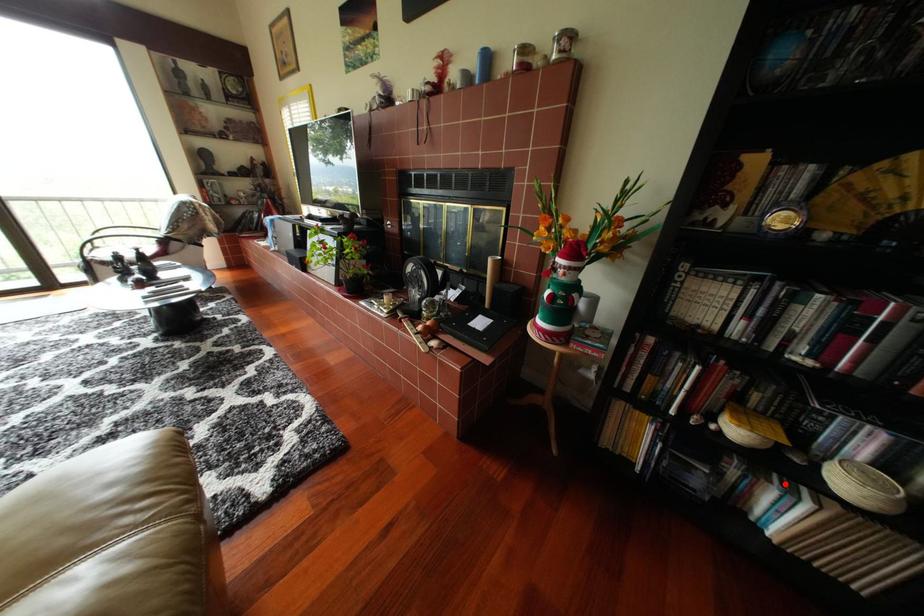
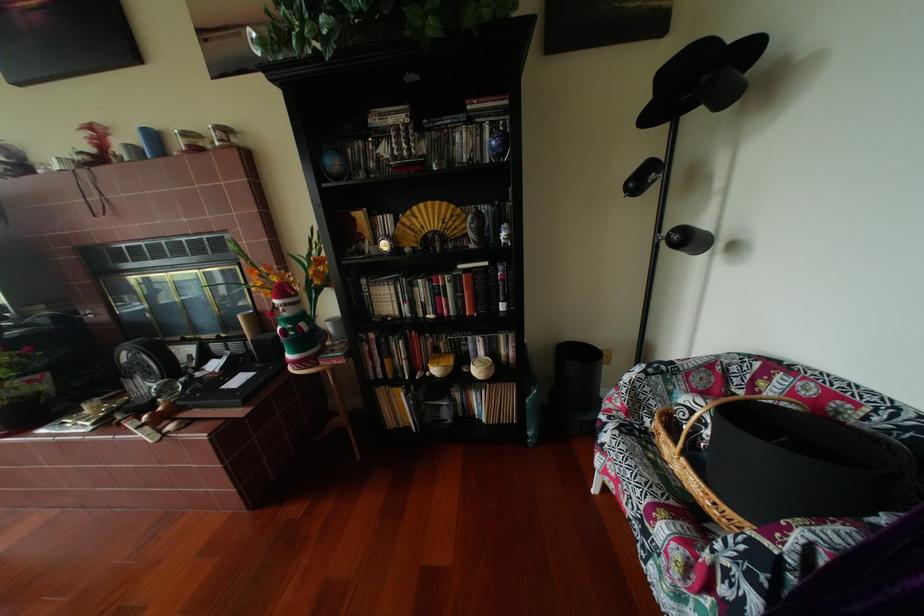
In the second image, find the point that corresponds to the highlighted location in the first image.

(484, 391)